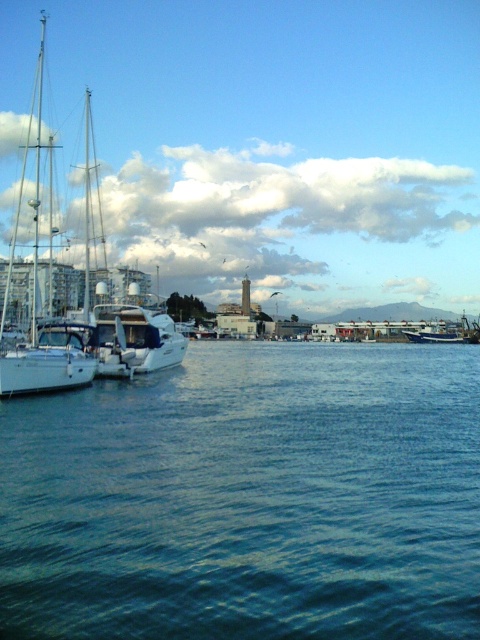
Looking at this image, you are a crane operator tasked with lifting the white glossy sailboat at left and the blue matte boat at center onto a truck. Which boat will require a taller crane to lift due to its height?

The white glossy sailboat at left is much taller than the blue matte boat at center, so it will require a taller crane to lift.